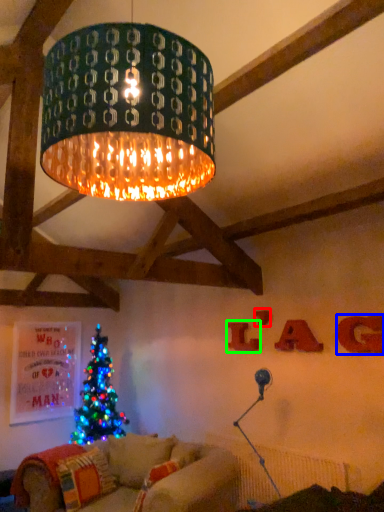
Question: Estimate the real-world distances between objects in this image. Which object is closer to letter (highlighted by a red box), letter (highlighted by a blue box) or letter (highlighted by a green box)?

Choices:
 (A) letter
 (B) letter

Answer: (B)